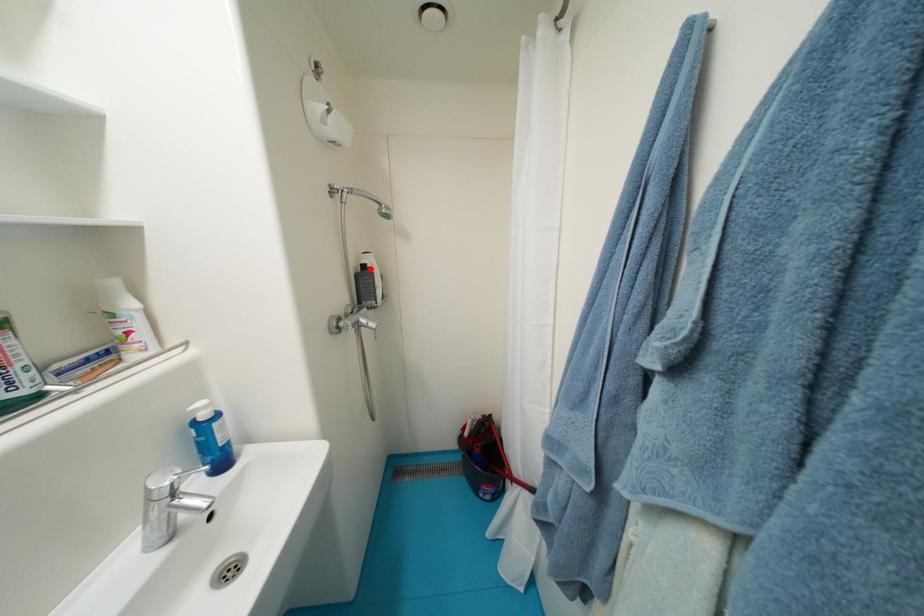
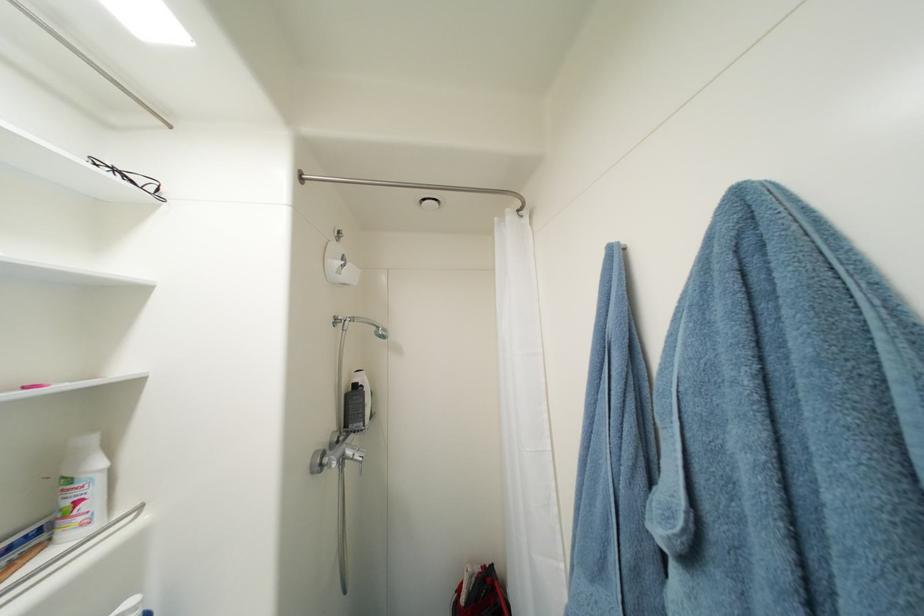
Where in the second image is the point corresponding to the highlighted location from the first image?

(361, 387)